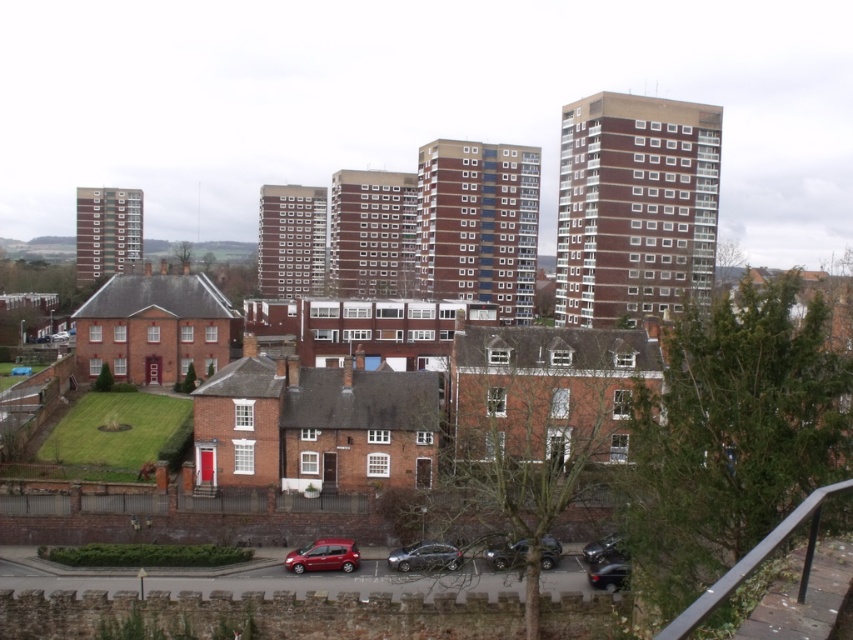
You are standing at the point with coordinates point (107, 230). What object are you standing on?

You are standing on the brick tower block at left.

You are standing at the entrance of the brick tower block at left and want to reach the metallic gray car at lower center. Which direction should you walk to get closer to the car?

Since the brick tower block at left is closer to you than the metallic gray car at lower center, you should walk away from the tower block towards the car to get closer to it.